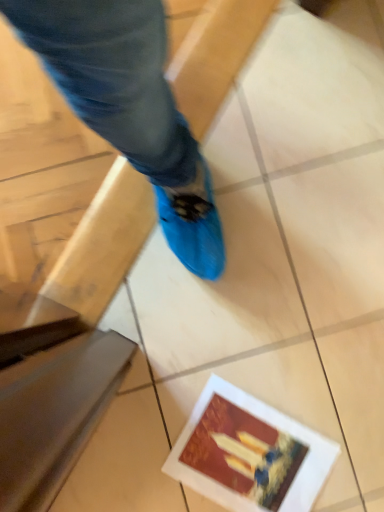
The image size is (384, 512). Identify the location of vacant location below matte paper postcard at lower right (from a real-world perspective). (249, 462).